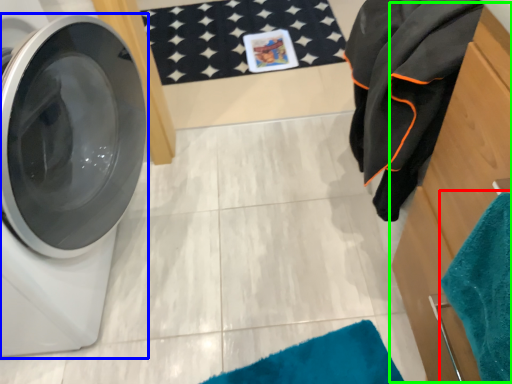
Question: Which is farther away from beach towel (highlighted by a red box)? washing machine (highlighted by a blue box) or dresser (highlighted by a green box)?

Choices:
 (A) washing machine
 (B) dresser

Answer: (A)